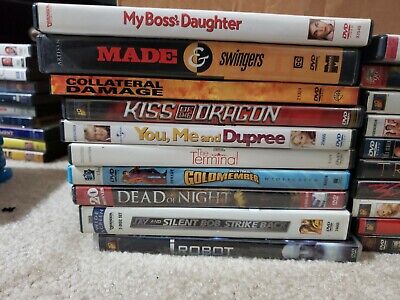
At what (x,y) coordinates should I click in order to perform the action: click on blue colored dvd case spines. Please return your answer as a coordinate pair (x, y). This screenshot has height=300, width=400. Looking at the image, I should click on (7, 100), (7, 122), (13, 133), (151, 242), (378, 147), (287, 175).